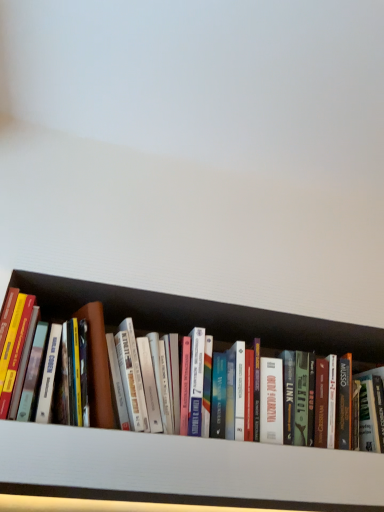
Question: From the image's perspective, is hardcover books at center above or below white wood cabinet at lower center?

Choices:
 (A) below
 (B) above

Answer: (B)

Question: Is hardcover books at center to the left or to the right of white wood cabinet at lower center in the image?

Choices:
 (A) left
 (B) right

Answer: (A)

Question: In the image, is hardcover books at center positioned in front of or behind white wood cabinet at lower center?

Choices:
 (A) behind
 (B) front

Answer: (A)

Question: In terms of size, does white wood cabinet at lower center appear bigger or smaller than hardcover books at center?

Choices:
 (A) big
 (B) small

Answer: (B)

Question: Would you say white wood cabinet at lower center is to the left or to the right of hardcover books at center in the picture?

Choices:
 (A) right
 (B) left

Answer: (A)

Question: Is white wood cabinet at lower center in front of or behind hardcover books at center in the image?

Choices:
 (A) front
 (B) behind

Answer: (A)

Question: From a real-world perspective, relative to hardcover books at center, is white wood cabinet at lower center vertically above or below?

Choices:
 (A) above
 (B) below

Answer: (B)